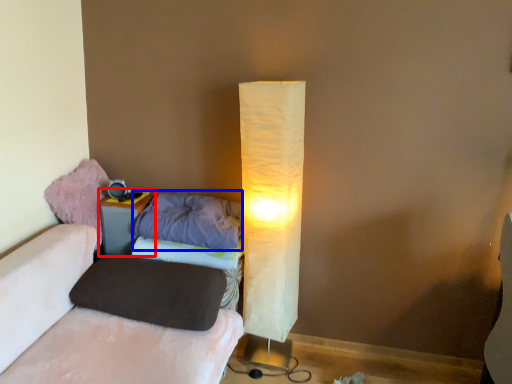
Question: Which object is closer to the camera taking this photo, nightstand (highlighted by a red box) or pillow (highlighted by a blue box)?

Choices:
 (A) nightstand
 (B) pillow

Answer: (B)